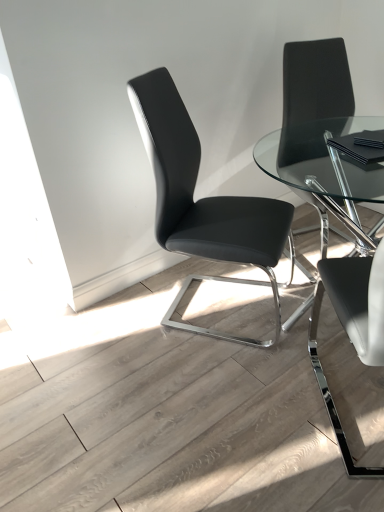
Where is `vacant area situated to the left side of black leather chair at center, which ranks as the 1th chair in left-to-right order`? The height and width of the screenshot is (512, 384). vacant area situated to the left side of black leather chair at center, which ranks as the 1th chair in left-to-right order is located at coordinates (116, 334).